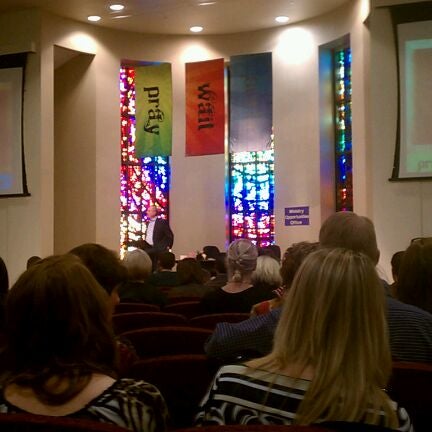
Where is `plaque on wall`? The height and width of the screenshot is (432, 432). plaque on wall is located at coordinates (301, 218).